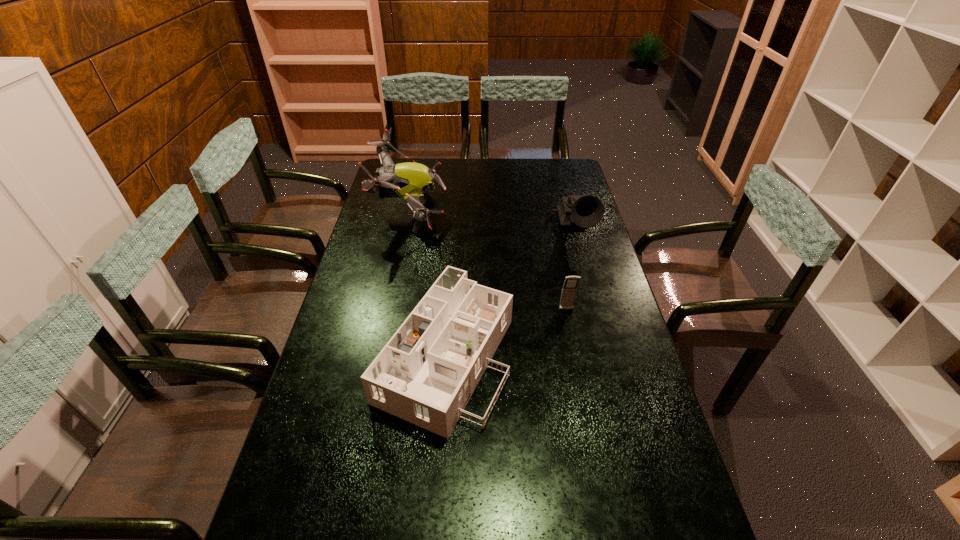
Where is `phonograph_record located at the right edge`? phonograph_record located at the right edge is located at coordinates (587, 211).

You are a GUI agent. You are given a task and a screenshot of the screen. Output one action in this format:
    pyautogui.click(x=<x>, y=<y>)
    Task: Click on the cellular telephone located in the right edge section of the desktop
    This screenshot has width=960, height=540.
    Given the screenshot: What is the action you would take?
    pyautogui.click(x=569, y=289)

I want to click on object that is at the far left corner, so click(409, 181).

Find the location of a particular element. The width and height of the screenshot is (960, 540). vacant point at the far edge is located at coordinates (522, 176).

What are the coordinates of `vacant space at the left edge` in the screenshot? It's located at (337, 421).

What are the coordinates of `free region at the right edge of the desktop` in the screenshot? It's located at (604, 292).

Identify the location of free region at the far right corner. (574, 159).

Locate an element on the screen. The image size is (960, 540). free space between the cellular telephone and the shortest object is located at coordinates (506, 332).

Image resolution: width=960 pixels, height=540 pixels. I want to click on free space between the shortest object and the phonograph_record, so click(511, 291).

Where is `vacant point located between the dollhouse and the cellular telephone`? vacant point located between the dollhouse and the cellular telephone is located at coordinates (506, 332).